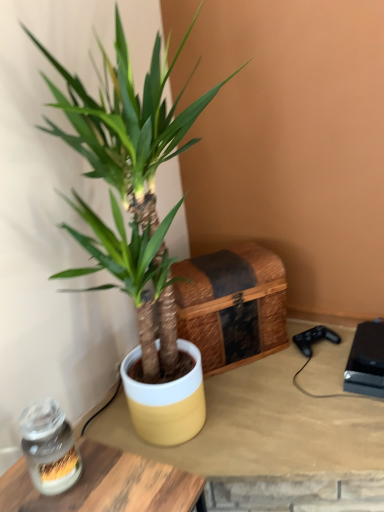
Where is `free spot above wooden table at lower left, the second table when ordered from back to front (from a real-world perspective)`? This screenshot has height=512, width=384. free spot above wooden table at lower left, the second table when ordered from back to front (from a real-world perspective) is located at coordinates (96, 483).